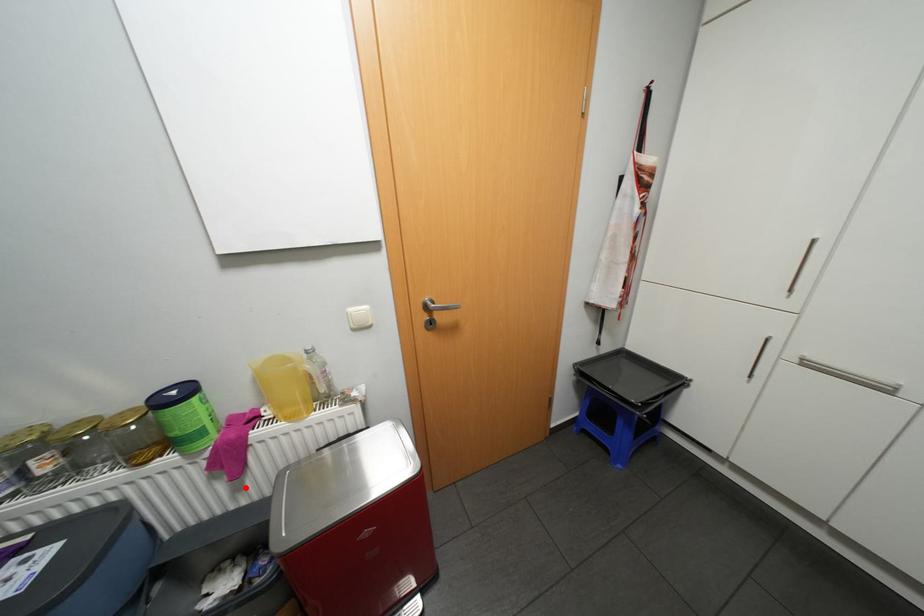
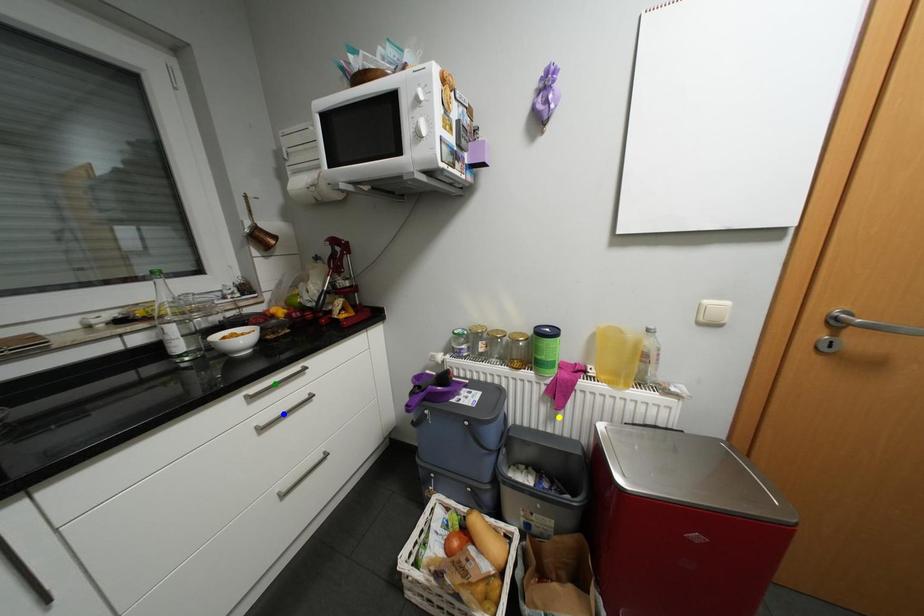
Question: I am providing you with two images of the same scene from different viewpoints. A red point is marked on the first image. You are given multiple points on the second image. In image 2, which mark is for the same physical point as the one in image 1?

Choices:
 (A) blue point
 (B) green point
 (C) yellow point

Answer: (C)